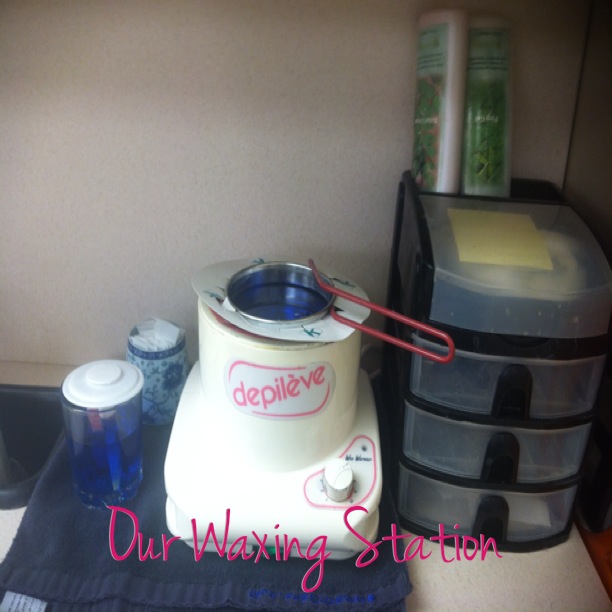
The image size is (612, 612). In order to click on cup in this screenshot , I will do `click(166, 370)`.